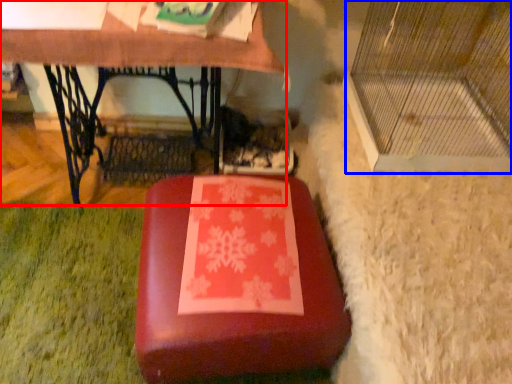
Question: Which of the following is the closest to the observer, table (highlighted by a red box) or glass door (highlighted by a blue box)?

Choices:
 (A) table
 (B) glass door

Answer: (B)